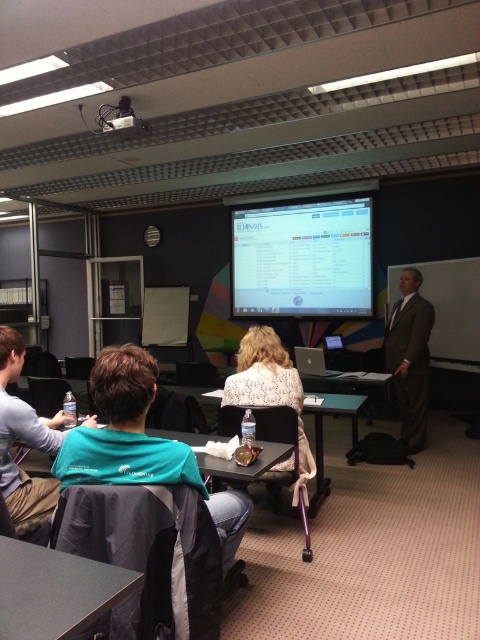
Is matte plastic monitor at center below teal fabric shirt at center?

No.

Between matte plastic monitor at center and teal fabric shirt at center, which one has more height?

Standing taller between the two is matte plastic monitor at center.

This screenshot has height=640, width=480. I want to click on matte plastic monitor at center, so click(x=302, y=259).

Is teal fabric shirt at center taller than satin brown suit at right?

Incorrect, teal fabric shirt at center's height is not larger of satin brown suit at right's.

Who is more distant from viewer, (85, 444) or (420, 336)?

The point (420, 336) is behind.

Is point (142, 406) positioned behind point (416, 314)?

No.

You are a GUI agent. You are given a task and a screenshot of the screen. Output one action in this format:
    pyautogui.click(x=<x>, y=<y>)
    Task: Click on the teal fabric shirt at center
    The width and height of the screenshot is (480, 640).
    Given the screenshot: What is the action you would take?
    pyautogui.click(x=143, y=449)

Locate an element on the screen. white textured blouse at center is located at coordinates (269, 388).

Can you confirm if white textured blouse at center is shorter than white plastic projector at upper center?

In fact, white textured blouse at center may be taller than white plastic projector at upper center.

Is point (266, 355) more distant than point (134, 134)?

No, it is in front of (134, 134).

Image resolution: width=480 pixels, height=640 pixels. I want to click on white textured blouse at center, so click(269, 388).